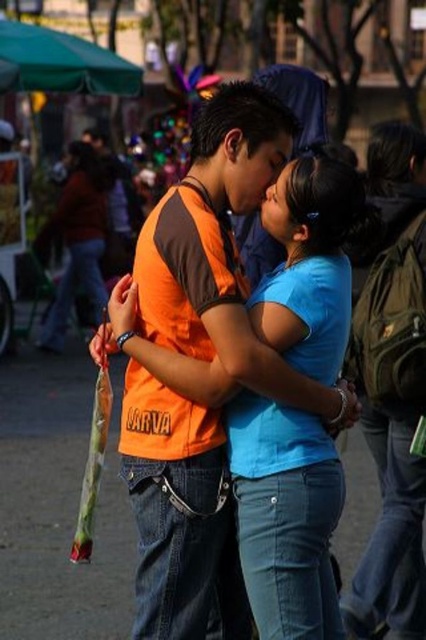
The width and height of the screenshot is (426, 640). What do you see at coordinates (285, 516) in the screenshot?
I see `blue denim jeans at center` at bounding box center [285, 516].

Is blue denim jeans at center further to the viewer compared to blue matte shirt at center?

No, blue denim jeans at center is closer to the viewer.

Does point (241, 444) come farther from viewer compared to point (89, 266)?

No.

This screenshot has width=426, height=640. I want to click on blue denim jeans at center, so click(285, 516).

Between orange cotton shirt at center and blue matte shirt at center, which one is positioned lower?

Positioned lower is orange cotton shirt at center.

What do you see at coordinates (221, 248) in the screenshot? I see `orange cotton shirt at center` at bounding box center [221, 248].

In order to click on orange cotton shirt at center in this screenshot , I will do `click(221, 248)`.

Between orange cotton shirt at center and blue denim jeans at center, which one has more height?

Standing taller between the two is orange cotton shirt at center.

Does point (160, 243) come in front of point (293, 531)?

No, it is behind (293, 531).

This screenshot has width=426, height=640. Identify the location of orange cotton shirt at center. (221, 248).